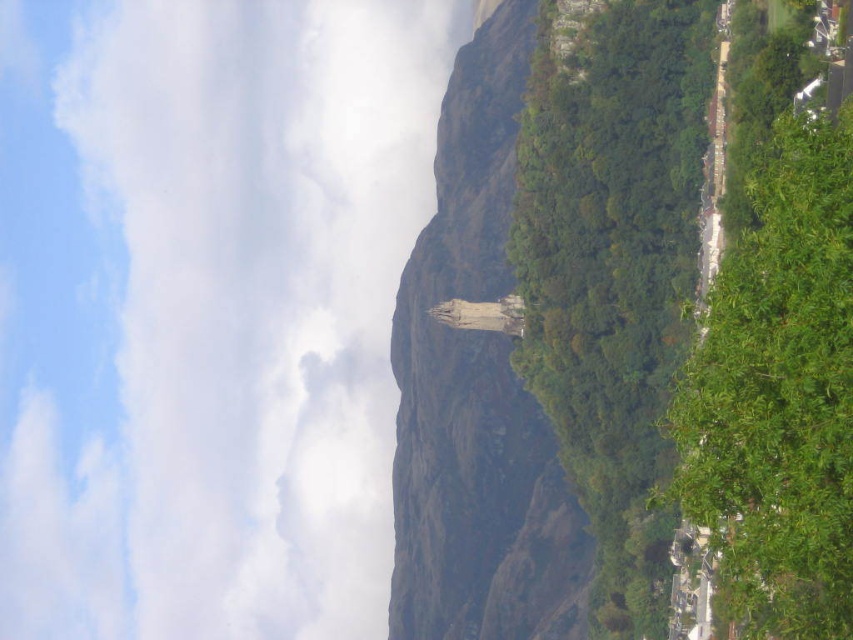
You are standing at the base of the mountain and want to reach the stone structure on top. You notice two points marked in the image. Which point is closer to you, point (254,214) or point (596,538)?

Point (254,214) is closer to you because it is further to the viewer than point (596,538).

You are an artist trying to paint this landscape. You want to ensure the white fluffy cloud at upper center and the green leafy tree at right are proportionally accurate. Which object should you draw wider?

The white fluffy cloud at upper center should be drawn wider because its width surpasses that of the green leafy tree at right according to the description.

You are a hiker standing at the base of the mountain and want to take a photo of both the green leafy tree at center and the green leafy tree at right. Which tree should you position closer to the camera to include both in the frame?

To include both the green leafy tree at center and the green leafy tree at right in the frame, you should position the green leafy tree at right closer to the camera since it is smaller in size than the green leafy tree at center.